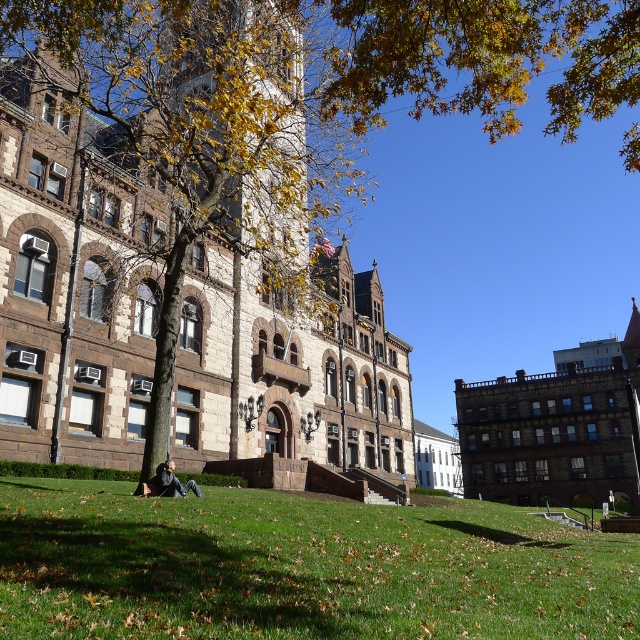
Is point (124, 566) positioned after point (177, 490)?

No, it is not.

Locate an element on the screen. This screenshot has height=640, width=640. green grass at lower center is located at coordinates (300, 566).

In order to click on green grass at lower center in this screenshot , I will do `click(300, 566)`.